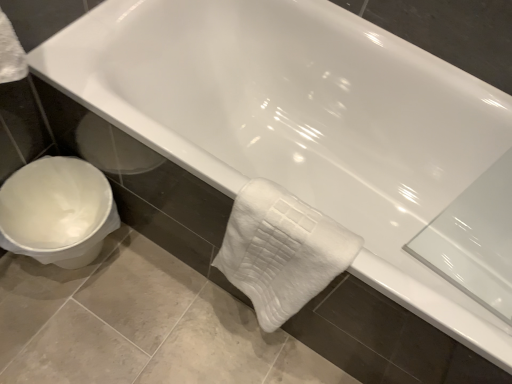
Question: Is white plastic toilet at lower left at the left side of white fluffy bath towel at lower center?

Choices:
 (A) no
 (B) yes

Answer: (B)

Question: Does white plastic toilet at lower left turn towards white fluffy bath towel at lower center?

Choices:
 (A) yes
 (B) no

Answer: (A)

Question: From the image's perspective, would you say white plastic toilet at lower left is shown under white fluffy bath towel at lower center?

Choices:
 (A) no
 (B) yes

Answer: (A)

Question: Does white plastic toilet at lower left have a larger size compared to white fluffy bath towel at lower center?

Choices:
 (A) yes
 (B) no

Answer: (A)

Question: Can you confirm if white plastic toilet at lower left is positioned to the right of white fluffy bath towel at lower center?

Choices:
 (A) yes
 (B) no

Answer: (B)

Question: Is white plastic toilet at lower left completely or partially outside of white fluffy bath towel at lower center?

Choices:
 (A) yes
 (B) no

Answer: (A)

Question: Considering the relative sizes of white fluffy bath towel at lower center and white plastic toilet at lower left in the image provided, is white fluffy bath towel at lower center wider than white plastic toilet at lower left?

Choices:
 (A) no
 (B) yes

Answer: (A)

Question: Could white plastic toilet at lower left be considered to be inside white fluffy bath towel at lower center?

Choices:
 (A) no
 (B) yes

Answer: (A)

Question: Could you tell me if white fluffy bath towel at lower center is turned towards white plastic toilet at lower left?

Choices:
 (A) no
 (B) yes

Answer: (A)

Question: Considering the relative sizes of white fluffy bath towel at lower center and white plastic toilet at lower left in the image provided, is white fluffy bath towel at lower center smaller than white plastic toilet at lower left?

Choices:
 (A) no
 (B) yes

Answer: (B)

Question: Is white fluffy bath towel at lower center not close to white plastic toilet at lower left?

Choices:
 (A) no
 (B) yes

Answer: (A)

Question: Is the position of white fluffy bath towel at lower center less distant than that of white plastic toilet at lower left?

Choices:
 (A) no
 (B) yes

Answer: (B)

Question: Would you say white plastic toilet at lower left is to the left or to the right of white fluffy bath towel at lower center in the picture?

Choices:
 (A) right
 (B) left

Answer: (B)